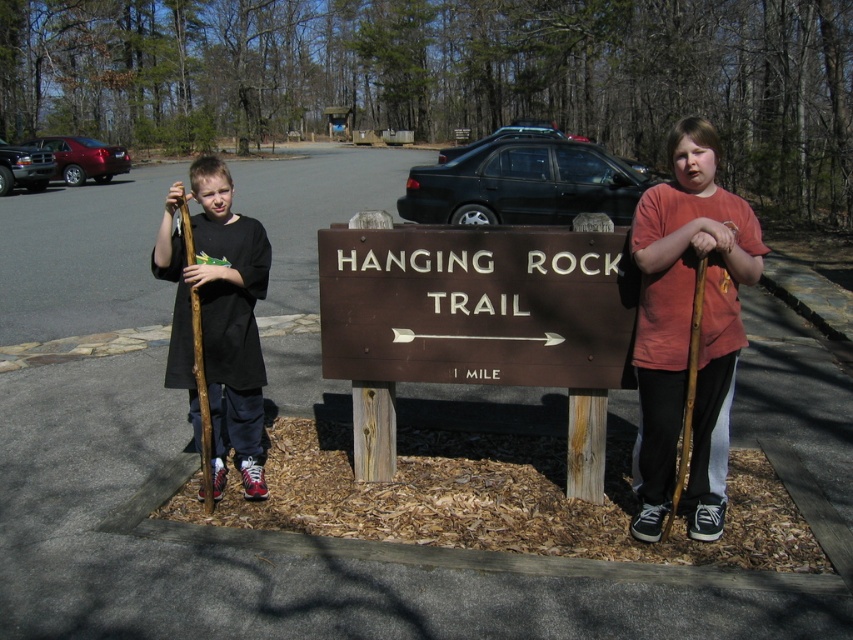
Question: Is the position of brown wooden sign at center less distant than that of matte black shirt at left?

Choices:
 (A) yes
 (B) no

Answer: (A)

Question: Does wooden stick at right appear on the right side of matte black shirt at left?

Choices:
 (A) no
 (B) yes

Answer: (B)

Question: Which object is closer to the camera taking this photo?

Choices:
 (A) wooden stick at right
 (B) brown rough wooden stick at left
 (C) brown wooden sign at center

Answer: (A)

Question: Does brown wooden sign at center have a lesser width compared to brown rough wooden stick at left?

Choices:
 (A) no
 (B) yes

Answer: (A)

Question: Which of the following is the farthest from the observer?

Choices:
 (A) (540, 232)
 (B) (200, 419)
 (C) (668, 161)

Answer: (C)

Question: Which point appears closest to the camera in this image?

Choices:
 (A) (321, 298)
 (B) (207, 426)
 (C) (637, 372)
 (D) (165, 244)

Answer: (C)